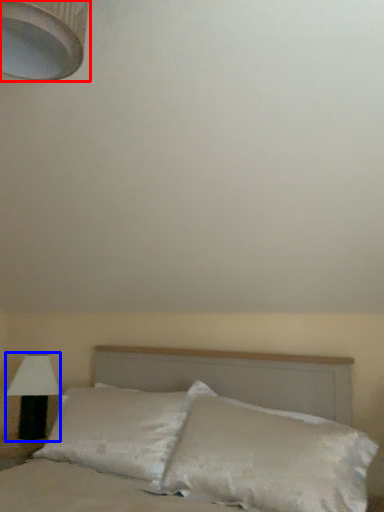
Question: Which of the following is the closest to the observer, lamp (highlighted by a red box) or lamp (highlighted by a blue box)?

Choices:
 (A) lamp
 (B) lamp

Answer: (A)